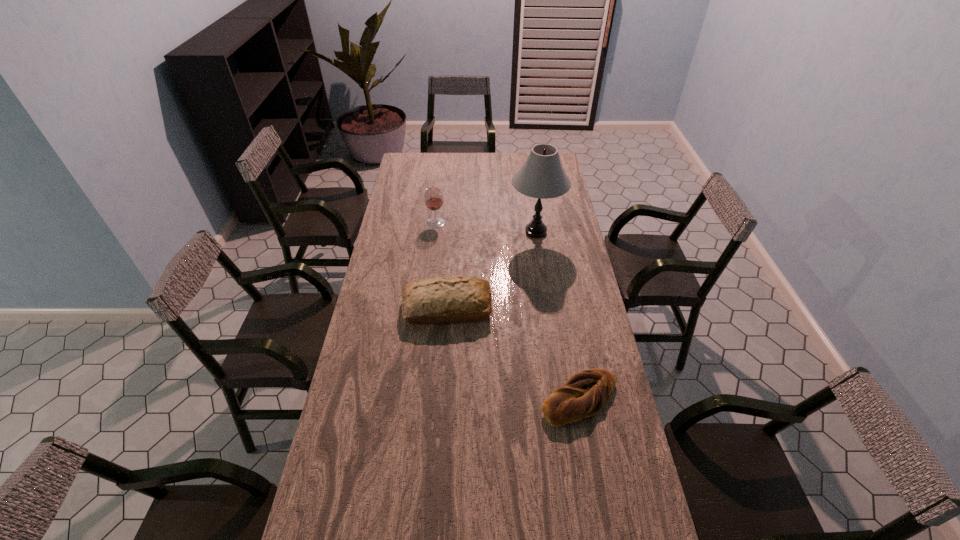
In order to click on object located in the left edge section of the desktop in this screenshot , I will do `click(454, 299)`.

Identify the location of lamp that is at the right edge. Image resolution: width=960 pixels, height=540 pixels. (542, 176).

Find the location of a particular element. bread situated at the right edge is located at coordinates (585, 393).

The image size is (960, 540). In the image, there is a desktop. Find the location of `free space at the far edge`. free space at the far edge is located at coordinates (503, 153).

Locate an element on the screen. The image size is (960, 540). free space at the left edge of the desktop is located at coordinates 358,430.

The height and width of the screenshot is (540, 960). What are the coordinates of `vacant space at the right edge` in the screenshot? It's located at (567, 303).

Find the location of `vacant area at the far left corner of the desktop`. vacant area at the far left corner of the desktop is located at coordinates (407, 153).

Find the location of a particular element. The width and height of the screenshot is (960, 540). vacant space that's between the second nearest object and the lamp is located at coordinates (492, 270).

Find the location of a particular element. Image resolution: width=960 pixels, height=540 pixels. free point between the nearer bread and the left bread is located at coordinates (514, 353).

Locate an element on the screen. The width and height of the screenshot is (960, 540). vacant space in between the lamp and the second tallest object is located at coordinates (486, 227).